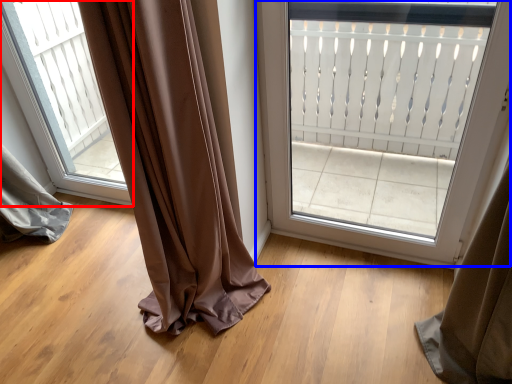
Question: Which of the following is the closest to the observer, window (highlighted by a red box) or door (highlighted by a blue box)?

Choices:
 (A) window
 (B) door

Answer: (B)